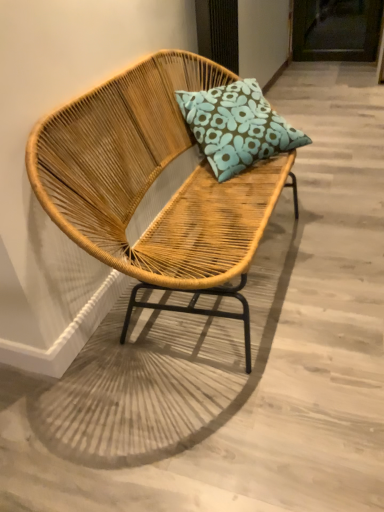
You are a GUI agent. You are given a task and a screenshot of the screen. Output one action in this format:
    pyautogui.click(x=<x>, y=<y>)
    Task: Click on the spots to the right of bamboo woven chair at center
    The height and width of the screenshot is (512, 384).
    Given the screenshot: What is the action you would take?
    pyautogui.click(x=339, y=243)